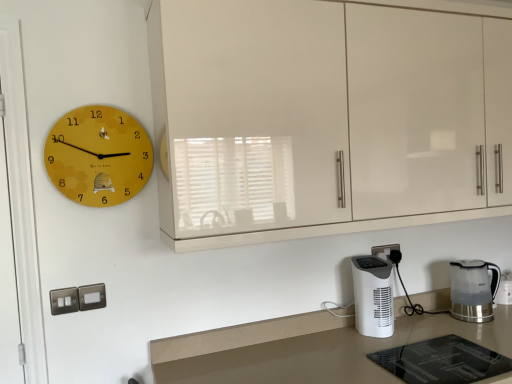
The image size is (512, 384). What do you see at coordinates (384, 251) in the screenshot?
I see `white plastic electric outlet at lower right` at bounding box center [384, 251].

What is the approximate width of yellow matte clock at upper left?

yellow matte clock at upper left is 1.64 inches wide.

The width and height of the screenshot is (512, 384). I want to click on transparent glass door at left, so click(x=21, y=202).

Image resolution: width=512 pixels, height=384 pixels. I want to click on glossy cream cabinetry at upper center, so click(326, 118).

Does white glossy countertop at lower center have a smaller size compared to white plastic electric outlet at lower right?

No.

Measure the distance between white glossy countertop at lower center and white plastic electric outlet at lower right.

50.56 centimeters.

Is white glossy countertop at lower center to the left of white plastic electric outlet at lower right from the viewer's perspective?

Indeed, white glossy countertop at lower center is positioned on the left side of white plastic electric outlet at lower right.

From their relative heights in the image, would you say white glossy countertop at lower center is taller or shorter than white plastic electric outlet at lower right?

white glossy countertop at lower center is taller than white plastic electric outlet at lower right.

From the image's perspective, is transparent glass door at left below white plastic electric outlet at lower right?

Incorrect, from the image's perspective, transparent glass door at left is higher than white plastic electric outlet at lower right.

From a real-world perspective, is transparent glass door at left below white plastic electric outlet at lower right?

Incorrect, from a real-world perspective, transparent glass door at left is higher than white plastic electric outlet at lower right.

Considering the positions of point (24, 170) and point (371, 252), is point (24, 170) closer or farther from the camera than point (371, 252)?

Point (24, 170) appears to be closer to the viewer than point (371, 252).

Who is taller, transparent glass door at left or white plastic electric outlet at lower right?

Standing taller between the two is transparent glass door at left.

Is point (30, 161) positioned before point (65, 161)?

Yes, point (30, 161) is closer to viewer.

Considering the positions of objects transparent glass door at left and yellow matte clock at upper left in the image provided, who is more to the left, transparent glass door at left or yellow matte clock at upper left?

transparent glass door at left is more to the left.

From a real-world perspective, which object rests below the other?

transparent glass door at left, from a real-world perspective.

Is transparent glass door at left positioned with its back to yellow matte clock at upper left?

No, transparent glass door at left is not facing the opposite direction of yellow matte clock at upper left.

Which object is further away from the camera taking this photo, glossy cream cabinetry at upper center or transparent glass door at left?

transparent glass door at left.

Measure the distance between glossy cream cabinetry at upper center and transparent glass door at left.

The distance of glossy cream cabinetry at upper center from transparent glass door at left is 1.03 meters.

Does glossy cream cabinetry at upper center appear on the right side of transparent glass door at left?

Correct, you'll find glossy cream cabinetry at upper center to the right of transparent glass door at left.

Which of these two, glossy cream cabinetry at upper center or transparent glass door at left, stands taller?

transparent glass door at left.

Is white glossy countertop at lower center further to the viewer compared to transparent plastic kettle at lower right, acting as the first home appliance starting from the right?

No, white glossy countertop at lower center is closer to the camera.

Based on the photo, does white glossy countertop at lower center have a smaller size compared to transparent plastic kettle at lower right, acting as the second home appliance starting from the left?

No, white glossy countertop at lower center is not smaller than transparent plastic kettle at lower right, acting as the second home appliance starting from the left.

Is the surface of white glossy countertop at lower center in direct contact with transparent plastic kettle at lower right, acting as the first home appliance starting from the right?

white glossy countertop at lower center and transparent plastic kettle at lower right, acting as the first home appliance starting from the right, are not in contact.

Can you confirm if white glossy countertop at lower center is shorter than transparent plastic kettle at lower right, acting as the second home appliance starting from the left?

Answer: In fact, white glossy countertop at lower center may be taller than transparent plastic kettle at lower right, acting as the second home appliance starting from the left.

What's the angular difference between glossy cream cabinetry at upper center and white plastic electric outlet at lower right's facing directions?

2.5 degrees separate the facing orientations of glossy cream cabinetry at upper center and white plastic electric outlet at lower right.

From a real-world perspective, is glossy cream cabinetry at upper center physically below white plastic electric outlet at lower right?

No.

Considering the positions of objects glossy cream cabinetry at upper center and white plastic electric outlet at lower right in the image provided, who is more to the left, glossy cream cabinetry at upper center or white plastic electric outlet at lower right?

From the viewer's perspective, glossy cream cabinetry at upper center appears more on the left side.

Is glossy cream cabinetry at upper center outside of white plastic electric outlet at lower right?

glossy cream cabinetry at upper center is positioned outside white plastic electric outlet at lower right.

This screenshot has width=512, height=384. Find the location of `the 2nd home appliance in front of the white plastic electric outlet at lower right`. the 2nd home appliance in front of the white plastic electric outlet at lower right is located at coordinates (373, 296).

In terms of width, does white plastic electric outlet at lower right look wider or thinner when compared to white plastic heater at lower right, the second home appliance viewed from the right?

Clearly, white plastic electric outlet at lower right has less width compared to white plastic heater at lower right, the second home appliance viewed from the right.

Is white plastic electric outlet at lower right surrounding white plastic heater at lower right, the second home appliance viewed from the right?

No, white plastic electric outlet at lower right does not contain white plastic heater at lower right, the second home appliance viewed from the right.

Looking at this image, is white plastic electric outlet at lower right to the left of white plastic heater at lower right, which is the 1th home appliance in left-to-right order, from the viewer's perspective?

No, white plastic electric outlet at lower right is not to the left of white plastic heater at lower right, which is the 1th home appliance in left-to-right order.

Identify the location of countertop below the white plastic electric outlet at lower right (from a real-world perspective). The width and height of the screenshot is (512, 384). coord(308,348).

Locate an element on the screen. This screenshot has width=512, height=384. electric outlet lying below the transparent glass door at left (from the image's perspective) is located at coordinates (384, 251).

When comparing their distances from white plastic electric outlet at lower right, does yellow matte clock at upper left or transparent plastic kettle at lower right, acting as the second home appliance starting from the left, seem closer?

transparent plastic kettle at lower right, acting as the second home appliance starting from the left.

Looking at the image, which one is located closer to transparent glass door at left, transparent plastic kettle at lower right, acting as the second home appliance starting from the left, or glossy cream cabinetry at upper center?

glossy cream cabinetry at upper center lies closer to transparent glass door at left than the other object.

Looking at the image, which one is located closer to white plastic electric outlet at lower right, glossy cream cabinetry at upper center or white plastic heater at lower right, the second home appliance viewed from the right?

white plastic heater at lower right, the second home appliance viewed from the right, lies closer to white plastic electric outlet at lower right than the other object.

When comparing their distances from glossy cream cabinetry at upper center, does yellow matte clock at upper left or white glossy countertop at lower center seem closer?

The object closer to glossy cream cabinetry at upper center is yellow matte clock at upper left.

From the image, which object appears to be farther from transparent glass door at left, white plastic heater at lower right, which is the 1th home appliance in left-to-right order, or yellow matte clock at upper left?

white plastic heater at lower right, which is the 1th home appliance in left-to-right order, lies further to transparent glass door at left than the other object.

When comparing their distances from transparent plastic kettle at lower right, acting as the second home appliance starting from the left, does glossy cream cabinetry at upper center or white glossy countertop at lower center seem further?

glossy cream cabinetry at upper center lies further to transparent plastic kettle at lower right, acting as the second home appliance starting from the left, than the other object.

Which object lies nearer to the anchor point white plastic heater at lower right, which is the 1th home appliance in left-to-right order, transparent plastic kettle at lower right, acting as the second home appliance starting from the left, or white glossy countertop at lower center?

white glossy countertop at lower center is positioned closer to the anchor white plastic heater at lower right, which is the 1th home appliance in left-to-right order.

From the image, which object appears to be farther from yellow matte clock at upper left, white plastic electric outlet at lower right or glossy cream cabinetry at upper center?

white plastic electric outlet at lower right is positioned further to the anchor yellow matte clock at upper left.

The height and width of the screenshot is (384, 512). Identify the location of electric outlet between glossy cream cabinetry at upper center and transparent plastic kettle at lower right, acting as the first home appliance starting from the right, in the vertical direction. (384, 251).

I want to click on home appliance between yellow matte clock at upper left and glossy cream cabinetry at upper center in the horizontal direction, so click(373, 296).

Where is `countertop between yellow matte clock at upper left and white plastic electric outlet at lower right`? countertop between yellow matte clock at upper left and white plastic electric outlet at lower right is located at coordinates (308, 348).

Where is `electric outlet between glossy cream cabinetry at upper center and white glossy countertop at lower center vertically`? The width and height of the screenshot is (512, 384). electric outlet between glossy cream cabinetry at upper center and white glossy countertop at lower center vertically is located at coordinates (384, 251).